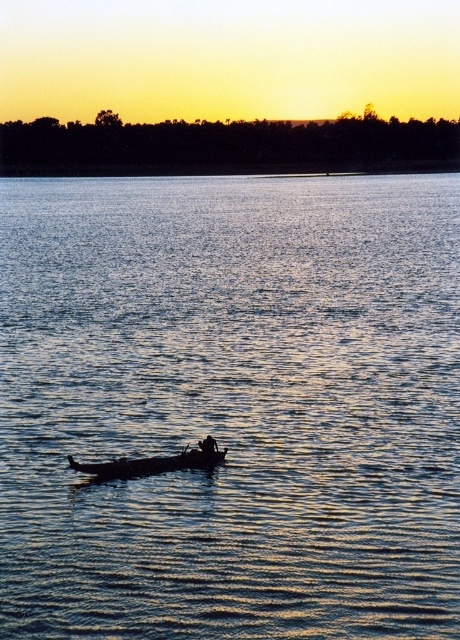
Is point (400, 227) more distant than point (201, 458)?

Yes, point (400, 227) is farther from viewer.

Does blue water at center have a greater height compared to wooden boat at center?

Correct, blue water at center is much taller as wooden boat at center.

The height and width of the screenshot is (640, 460). Describe the element at coordinates (230, 404) in the screenshot. I see `blue water at center` at that location.

Identify the location of blue water at center. (230, 404).

Looking at this image, can you confirm if blue water at center is wider than dark skin textured person at center?

Yes, blue water at center is wider than dark skin textured person at center.

Who is taller, blue water at center or dark skin textured person at center?

Standing taller between the two is blue water at center.

Locate an element on the screen. This screenshot has width=460, height=640. blue water at center is located at coordinates (230, 404).

Between point (134, 465) and point (201, 449), which one is positioned in front?

Point (134, 465)

What do you see at coordinates (149, 465) in the screenshot? I see `wooden boat at center` at bounding box center [149, 465].

Is point (155, 458) positioned after point (207, 448)?

Yes, point (155, 458) is behind point (207, 448).

I want to click on wooden boat at center, so click(149, 465).